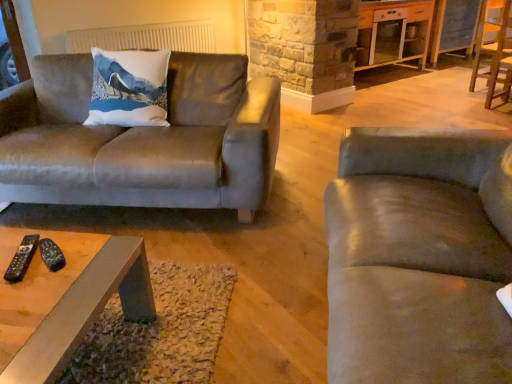
Question: Is the depth of suede-like gray couch at right, placed as the 2th studio couch when sorted from back to front, less than that of wooden chair at right?

Choices:
 (A) no
 (B) yes

Answer: (B)

Question: Is suede-like gray couch at right, which is counted as the 2th studio couch, starting from the left, further to camera compared to wooden chair at right?

Choices:
 (A) no
 (B) yes

Answer: (A)

Question: Considering the relative sizes of suede-like gray couch at right, arranged as the 1th studio couch when viewed from the right, and wooden chair at right in the image provided, is suede-like gray couch at right, arranged as the 1th studio couch when viewed from the right, thinner than wooden chair at right?

Choices:
 (A) yes
 (B) no

Answer: (B)

Question: Is suede-like gray couch at right, placed as the 2th studio couch when sorted from back to front, far from wooden chair at right?

Choices:
 (A) no
 (B) yes

Answer: (B)

Question: Is suede-like gray couch at right, placed as the 2th studio couch when sorted from back to front, at the left side of wooden chair at right?

Choices:
 (A) no
 (B) yes

Answer: (B)

Question: Can you confirm if suede-like gray couch at right, placed as the 2th studio couch when sorted from back to front, is positioned to the right of wooden chair at right?

Choices:
 (A) no
 (B) yes

Answer: (A)

Question: Considering the relative sizes of white glossy cabinet at upper right and white fabric radiator at upper center in the image provided, is white glossy cabinet at upper right smaller than white fabric radiator at upper center?

Choices:
 (A) yes
 (B) no

Answer: (B)

Question: Considering the relative sizes of white glossy cabinet at upper right and white fabric radiator at upper center in the image provided, is white glossy cabinet at upper right shorter than white fabric radiator at upper center?

Choices:
 (A) no
 (B) yes

Answer: (A)

Question: Considering the relative sizes of white glossy cabinet at upper right and white fabric radiator at upper center in the image provided, is white glossy cabinet at upper right wider than white fabric radiator at upper center?

Choices:
 (A) yes
 (B) no

Answer: (A)

Question: Is white glossy cabinet at upper right at the left side of white fabric radiator at upper center?

Choices:
 (A) no
 (B) yes

Answer: (A)

Question: Is white glossy cabinet at upper right far from white fabric radiator at upper center?

Choices:
 (A) no
 (B) yes

Answer: (B)

Question: Is white glossy cabinet at upper right positioned behind white fabric radiator at upper center?

Choices:
 (A) no
 (B) yes

Answer: (B)

Question: Considering the relative sizes of black plastic remote at lower left, positioned as the second remote in right-to-left order, and metallic gray coffee table at center in the image provided, is black plastic remote at lower left, positioned as the second remote in right-to-left order, smaller than metallic gray coffee table at center?

Choices:
 (A) yes
 (B) no

Answer: (A)